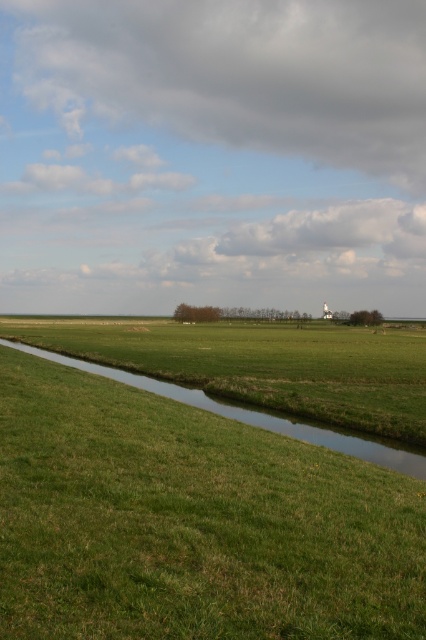
Question: Which object is farther from the camera taking this photo?

Choices:
 (A) green grassy field at center
 (B) green grassy stream at lower center

Answer: (B)

Question: Which object is closer to the camera taking this photo?

Choices:
 (A) green grassy field at center
 (B) green grassy stream at lower center

Answer: (A)

Question: Is green grassy field at center below green grassy stream at lower center?

Choices:
 (A) no
 (B) yes

Answer: (A)

Question: Can you confirm if green grassy field at center is smaller than green grassy stream at lower center?

Choices:
 (A) yes
 (B) no

Answer: (B)

Question: Is green grassy field at center positioned in front of green grassy stream at lower center?

Choices:
 (A) no
 (B) yes

Answer: (B)